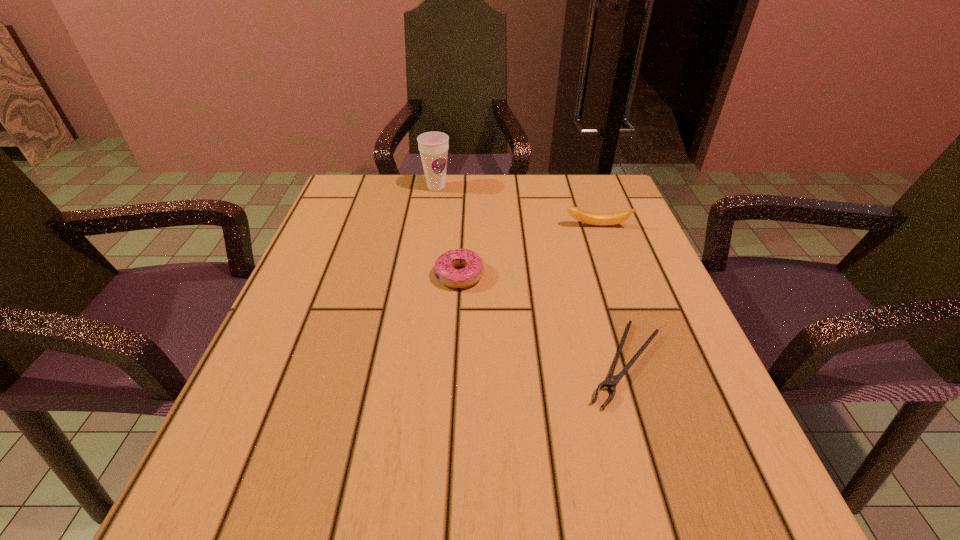
Locate an element on the screen. This screenshot has height=540, width=960. vacant area that lies between the third farthest object and the second farthest object is located at coordinates (528, 251).

Locate an element on the screen. This screenshot has width=960, height=540. free space between the doughnut and the banana is located at coordinates (528, 251).

Locate an element on the screen. The image size is (960, 540). unoccupied area between the nearest object and the banana is located at coordinates (611, 295).

Image resolution: width=960 pixels, height=540 pixels. I want to click on object identified as the third closest to the banana, so click(433, 146).

Find the location of a particular element. object that ranks as the third closest to the second tallest object is located at coordinates (433, 146).